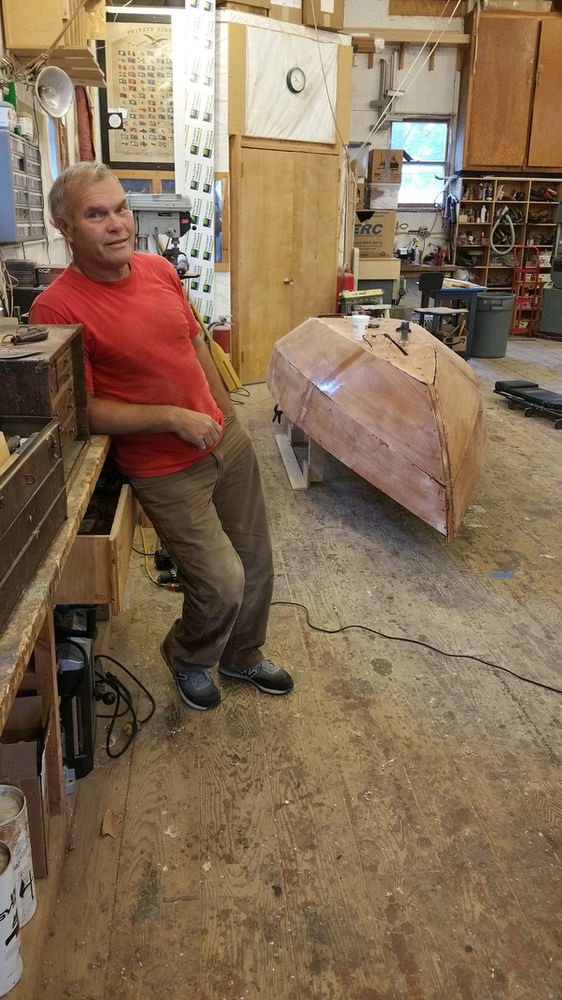
The width and height of the screenshot is (562, 1000). I want to click on tool chest, so click(x=43, y=507).